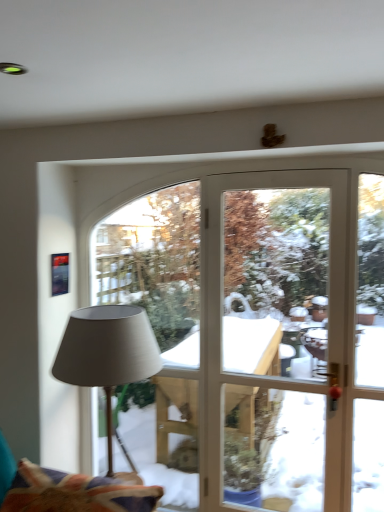
Question: Is matte gray fabric lamp at left oriented away from velvet fabric swivel chair at lower left?

Choices:
 (A) yes
 (B) no

Answer: (B)

Question: Considering the relative positions of matte gray fabric lamp at left and velvet fabric swivel chair at lower left in the image provided, is matte gray fabric lamp at left to the left of velvet fabric swivel chair at lower left from the viewer's perspective?

Choices:
 (A) yes
 (B) no

Answer: (B)

Question: Can we say matte gray fabric lamp at left lies outside velvet fabric swivel chair at lower left?

Choices:
 (A) no
 (B) yes

Answer: (B)

Question: From a real-world perspective, is matte gray fabric lamp at left on top of velvet fabric swivel chair at lower left?

Choices:
 (A) yes
 (B) no

Answer: (A)

Question: Does matte gray fabric lamp at left have a smaller size compared to velvet fabric swivel chair at lower left?

Choices:
 (A) yes
 (B) no

Answer: (B)

Question: From the image's perspective, does matte gray fabric lamp at left appear lower than velvet fabric swivel chair at lower left?

Choices:
 (A) yes
 (B) no

Answer: (B)

Question: Is velvet fabric swivel chair at lower left thinner than matte gray fabric lamp at left?

Choices:
 (A) no
 (B) yes

Answer: (A)

Question: From the image's perspective, does velvet fabric swivel chair at lower left appear higher than matte gray fabric lamp at left?

Choices:
 (A) yes
 (B) no

Answer: (B)

Question: From a real-world perspective, does velvet fabric swivel chair at lower left sit lower than matte gray fabric lamp at left?

Choices:
 (A) yes
 (B) no

Answer: (A)

Question: Is velvet fabric swivel chair at lower left not inside matte gray fabric lamp at left?

Choices:
 (A) no
 (B) yes

Answer: (B)

Question: Is velvet fabric swivel chair at lower left not close to matte gray fabric lamp at left?

Choices:
 (A) yes
 (B) no

Answer: (B)

Question: From the image's perspective, is velvet fabric swivel chair at lower left beneath matte gray fabric lamp at left?

Choices:
 (A) no
 (B) yes

Answer: (B)

Question: In terms of size, does matte gray fabric lamp at left appear bigger or smaller than velvet fabric swivel chair at lower left?

Choices:
 (A) big
 (B) small

Answer: (A)